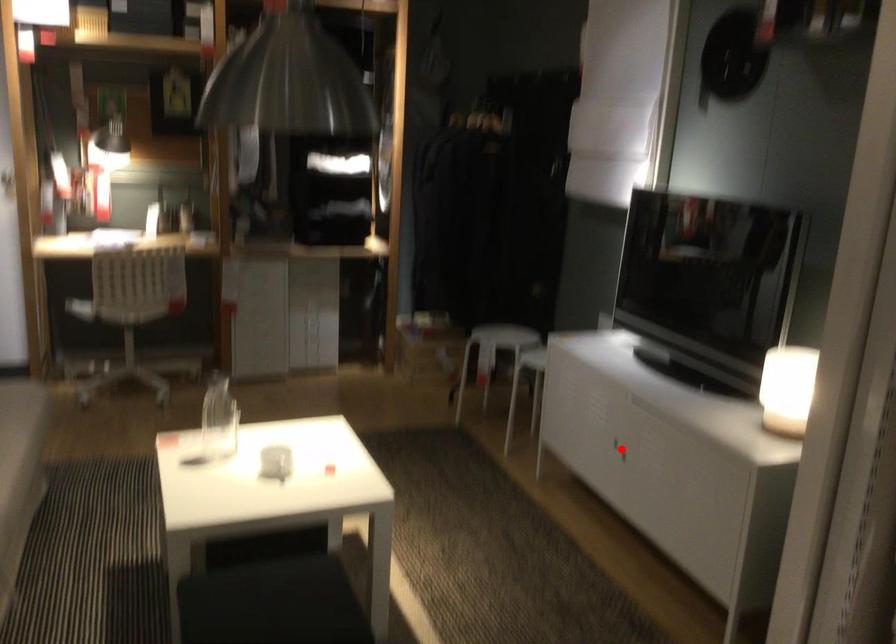
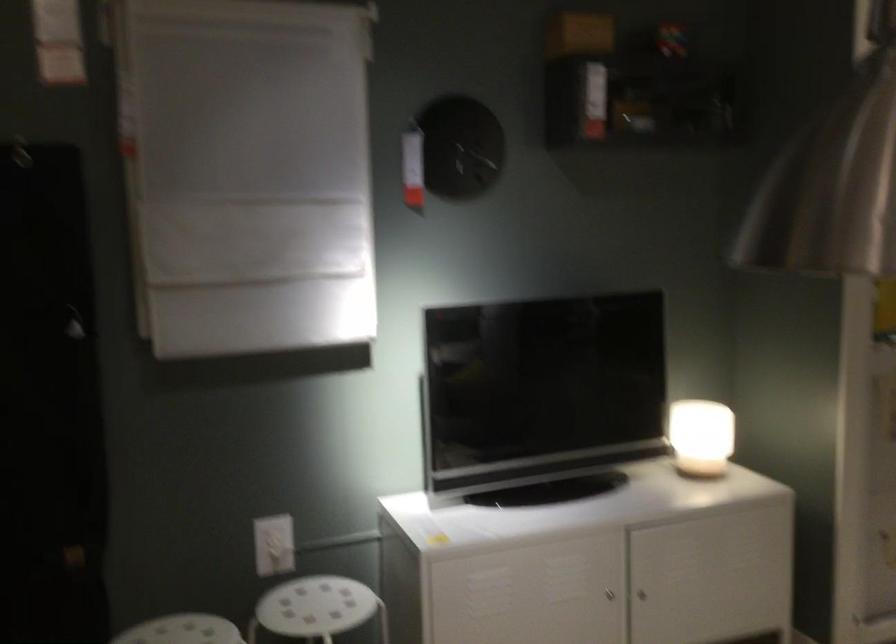
The point at the highlighted location is marked in the first image. Where is the corresponding point in the second image?

(641, 594)